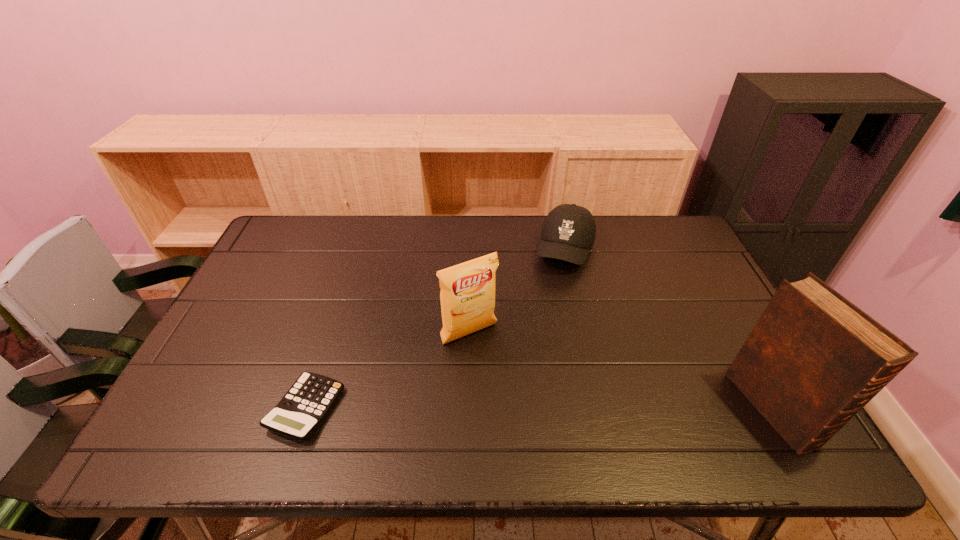
Where is `the shortest object`? the shortest object is located at coordinates (305, 405).

Locate an element on the screen. This screenshot has width=960, height=540. calculator is located at coordinates (x=305, y=405).

I want to click on the tallest object, so click(813, 360).

The width and height of the screenshot is (960, 540). I want to click on the rightmost object, so click(x=813, y=360).

Where is `crisp (potato chip)`? The image size is (960, 540). crisp (potato chip) is located at coordinates (467, 296).

At what (x,y) coordinates should I click in order to perform the action: click on the third nearest object. Please return your answer as a coordinate pair (x, y). Looking at the image, I should click on (467, 296).

The width and height of the screenshot is (960, 540). I want to click on the second object from right to left, so click(568, 232).

You are a GUI agent. You are given a task and a screenshot of the screen. Output one action in this format:
    pyautogui.click(x=<x>, y=<y>)
    Task: Click on the second shortest object
    The height and width of the screenshot is (540, 960).
    Given the screenshot: What is the action you would take?
    pyautogui.click(x=568, y=232)

What are the coordinates of `blank space located 0.390m on the right of the shortest object` in the screenshot? It's located at (509, 409).

At what (x,y) coordinates should I click in order to perform the action: click on vacant space located 0.180m on the back of the tallest object. Please return your answer as a coordinate pair (x, y). Looking at the image, I should click on (720, 314).